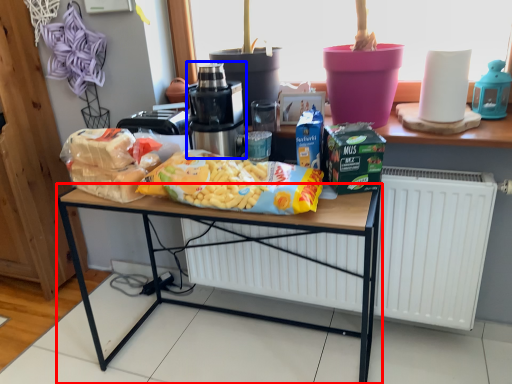
Question: Which point is closer to the camera, desk (highlighted by a red box) or home appliance (highlighted by a blue box)?

Choices:
 (A) desk
 (B) home appliance

Answer: (A)